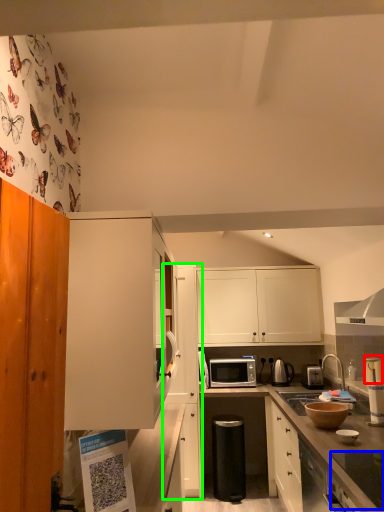
Question: Based on their relative distances, which object is nearer to appliance (highlighted by a red box)? Choose from appliance (highlighted by a blue box) and cabinetry (highlighted by a green box).

Choices:
 (A) appliance
 (B) cabinetry

Answer: (A)